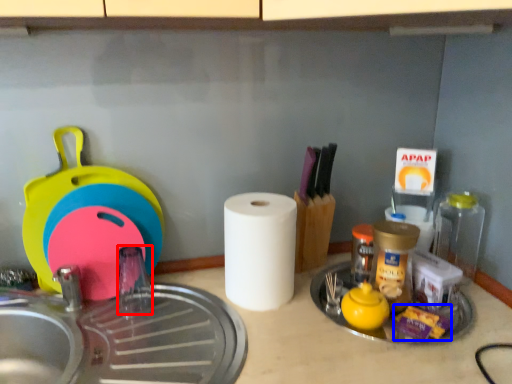
Question: Which object appears closest to the camera in this image, faucet (highlighted by a red box) or food (highlighted by a blue box)?

Choices:
 (A) faucet
 (B) food

Answer: (B)